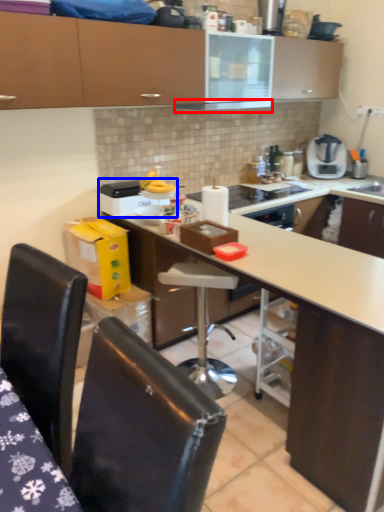
Question: Which object appears closest to the camera in this image, exhaust hood (highlighted by a red box) or kitchen appliance (highlighted by a blue box)?

Choices:
 (A) exhaust hood
 (B) kitchen appliance

Answer: (B)